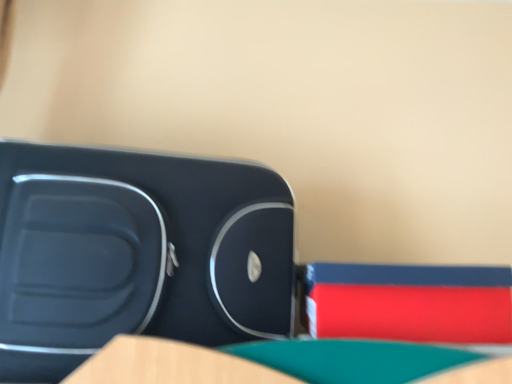
Question: Is matte plastic suitcase at left in front of or behind rubberized red book at right in the image?

Choices:
 (A) front
 (B) behind

Answer: (A)

Question: Is matte plastic suitcase at left inside the boundaries of rubberized red book at right, or outside?

Choices:
 (A) outside
 (B) inside

Answer: (A)

Question: From their relative heights in the image, would you say matte plastic suitcase at left is taller or shorter than rubberized red book at right?

Choices:
 (A) tall
 (B) short

Answer: (A)

Question: From the image's perspective, is rubberized red book at right above or below matte plastic suitcase at left?

Choices:
 (A) above
 (B) below

Answer: (B)

Question: In terms of height, does rubberized red book at right look taller or shorter compared to matte plastic suitcase at left?

Choices:
 (A) short
 (B) tall

Answer: (A)

Question: Is rubberized red book at right inside or outside of matte plastic suitcase at left?

Choices:
 (A) inside
 (B) outside

Answer: (B)

Question: Does point (306, 291) appear closer or farther from the camera than point (216, 322)?

Choices:
 (A) closer
 (B) farther

Answer: (B)